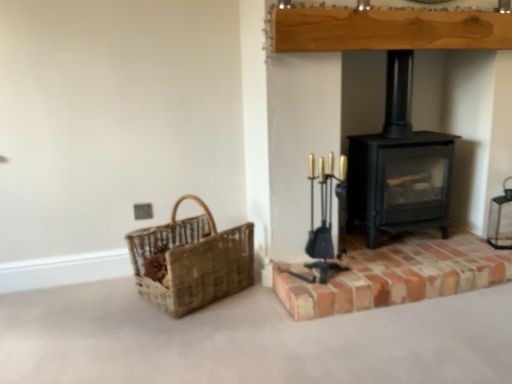
Describe the element at coordinates (399, 165) in the screenshot. This screenshot has width=512, height=384. I see `black matte wood burning stove at center-right` at that location.

You are a GUI agent. You are given a task and a screenshot of the screen. Output one action in this format:
    pyautogui.click(x=<x>, y=<y>)
    Task: Click on the black matte wood burning stove at center-right
    The image size is (512, 384).
    Given the screenshot: What is the action you would take?
    pyautogui.click(x=399, y=165)

Between brick at right and woven natural basket at left, which one appears on the left side from the viewer's perspective?

Positioned to the left is woven natural basket at left.

Based on the photo, from the image's perspective, would you say brick at right is positioned over woven natural basket at left?

No.

Is brick at right not within woven natural basket at left?

Yes, brick at right is outside of woven natural basket at left.

From a real-world perspective, is woven natural basket at left positioned over brick at right based on gravity?

Yes, from a real-world perspective, woven natural basket at left is over brick at right

Is there a large distance between woven natural basket at left and brick at right?

No, woven natural basket at left is not far away from brick at right.

Is woven natural basket at left wider or thinner than brick at right?

woven natural basket at left is thinner than brick at right.

Is point (360, 139) closer or farther from the camera than point (435, 289)?

Point (360, 139) is positioned farther from the camera compared to point (435, 289).

How many degrees apart are the facing directions of black matte wood burning stove at center-right and brick at right?

There is a 0.000298-degree angle between the facing directions of black matte wood burning stove at center-right and brick at right.

Considering the sizes of objects black matte wood burning stove at center-right and brick at right in the image provided, who is thinner, black matte wood burning stove at center-right or brick at right?

Thinner between the two is black matte wood burning stove at center-right.

Is black matte wood burning stove at center-right turned away from brick at right?

black matte wood burning stove at center-right does not have its back to brick at right.

Where is `wood burning stove that appears above the brick at right (from a real-world perspective)`? The width and height of the screenshot is (512, 384). wood burning stove that appears above the brick at right (from a real-world perspective) is located at coordinates (399, 165).

Between brick at right and black matte wood burning stove at center-right, which one has more height?

black matte wood burning stove at center-right is taller.

In the scene shown: Which is in front, brick at right or black matte wood burning stove at center-right?

Positioned in front is brick at right.

Is brick at right oriented away from black matte wood burning stove at center-right?

That's not correct — brick at right is not looking away from black matte wood burning stove at center-right.

Can you tell me how much woven natural basket at left and black matte wood burning stove at center-right differ in facing direction?

32.6 degrees.

This screenshot has height=384, width=512. What are the coordinates of `basket on the left of black matte wood burning stove at center-right` in the screenshot? It's located at (191, 261).

From a real-world perspective, is woven natural basket at left on black matte wood burning stove at center-right?

No.

Looking at this image, is woven natural basket at left behind black matte wood burning stove at center-right?

No.

Can you tell me how much black matte wood burning stove at center-right and woven natural basket at left differ in facing direction?

32.6 degrees separate the facing orientations of black matte wood burning stove at center-right and woven natural basket at left.

Considering the points (446, 229) and (213, 243), which point is behind, point (446, 229) or point (213, 243)?

The point (446, 229) is farther.

Looking at this image, is woven natural basket at left at the back of black matte wood burning stove at center-right?

black matte wood burning stove at center-right is not turned away from woven natural basket at left.

From a real-world perspective, who is located lower, black matte wood burning stove at center-right or woven natural basket at left?

woven natural basket at left, from a real-world perspective.

Where is `brickwork located below the woven natural basket at left (from the image's perspective)`? This screenshot has height=384, width=512. brickwork located below the woven natural basket at left (from the image's perspective) is located at coordinates (396, 274).

Where is `basket above the brick at right (from a real-world perspective)`? The height and width of the screenshot is (384, 512). basket above the brick at right (from a real-world perspective) is located at coordinates (191, 261).

Looking at this image, considering their positions, is woven natural basket at left positioned closer to brick at right than black matte wood burning stove at center-right?

black matte wood burning stove at center-right lies closer to brick at right than the other object.

Looking at this image, when comparing their distances from woven natural basket at left, does brick at right or black matte wood burning stove at center-right seem closer?

Based on the image, brick at right appears to be nearer to woven natural basket at left.

From the image, which object appears to be farther from woven natural basket at left, black matte wood burning stove at center-right or brick at right?

Based on the image, black matte wood burning stove at center-right appears to be further to woven natural basket at left.

Based on their spatial positions, is black matte wood burning stove at center-right or woven natural basket at left further from brick at right?

woven natural basket at left is positioned further to the anchor brick at right.

Considering their positions, is brick at right positioned closer to black matte wood burning stove at center-right than woven natural basket at left?

brick at right is closer to black matte wood burning stove at center-right.

Estimate the real-world distances between objects in this image. Which object is closer to black matte wood burning stove at center-right, woven natural basket at left or brick at right?

brick at right lies closer to black matte wood burning stove at center-right than the other object.

You are a GUI agent. You are given a task and a screenshot of the screen. Output one action in this format:
    pyautogui.click(x=<x>, y=<y>)
    Task: Click on the wood burning stove situated between woven natural basket at left and brick at right from left to right
    The height and width of the screenshot is (384, 512).
    Given the screenshot: What is the action you would take?
    pyautogui.click(x=399, y=165)